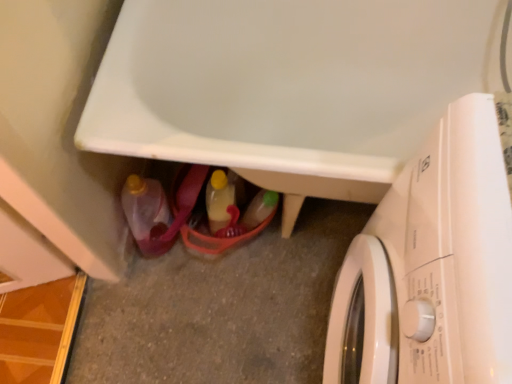
Question: Is white glossy washing machine at lower right aimed at matte plastic bottle at lower left, which is the 1th bottle in left-to-right order?

Choices:
 (A) no
 (B) yes

Answer: (B)

Question: From the image's perspective, is white glossy washing machine at lower right beneath matte plastic bottle at lower left, which appears as the second bottle when viewed from the right?

Choices:
 (A) yes
 (B) no

Answer: (A)

Question: Is white glossy washing machine at lower right at the right side of matte plastic bottle at lower left, which is the 1th bottle in left-to-right order?

Choices:
 (A) yes
 (B) no

Answer: (A)

Question: Is white glossy washing machine at lower right taller than matte plastic bottle at lower left, which appears as the second bottle when viewed from the right?

Choices:
 (A) no
 (B) yes

Answer: (B)

Question: Are white glossy washing machine at lower right and matte plastic bottle at lower left, which appears as the second bottle when viewed from the right, making contact?

Choices:
 (A) yes
 (B) no

Answer: (B)

Question: Is white glossy washing machine at lower right shorter than matte plastic bottle at lower left, which appears as the second bottle when viewed from the right?

Choices:
 (A) no
 (B) yes

Answer: (A)

Question: Can you confirm if translucent plastic bottle at center, marked as the 1th bottle in a right-to-left arrangement, is taller than matte plastic bottle at lower left, which appears as the second bottle when viewed from the right?

Choices:
 (A) no
 (B) yes

Answer: (A)

Question: Does translucent plastic bottle at center, acting as the second bottle starting from the left, have a smaller size compared to matte plastic bottle at lower left, which appears as the second bottle when viewed from the right?

Choices:
 (A) yes
 (B) no

Answer: (A)

Question: Does translucent plastic bottle at center, marked as the 1th bottle in a right-to-left arrangement, have a lesser width compared to matte plastic bottle at lower left, which appears as the second bottle when viewed from the right?

Choices:
 (A) no
 (B) yes

Answer: (B)

Question: From the image's perspective, is translucent plastic bottle at center, marked as the 1th bottle in a right-to-left arrangement, above matte plastic bottle at lower left, which is the 1th bottle in left-to-right order?

Choices:
 (A) no
 (B) yes

Answer: (B)

Question: Is translucent plastic bottle at center, acting as the second bottle starting from the left, outside of matte plastic bottle at lower left, which is the 1th bottle in left-to-right order?

Choices:
 (A) no
 (B) yes

Answer: (B)

Question: From the image's perspective, is translucent plastic bottle at center, marked as the 1th bottle in a right-to-left arrangement, beneath matte plastic bottle at lower left, which is the 1th bottle in left-to-right order?

Choices:
 (A) yes
 (B) no

Answer: (B)

Question: Is white glossy bathtub at lower center next to matte plastic bottle at lower left, which is the 1th bottle in left-to-right order?

Choices:
 (A) yes
 (B) no

Answer: (B)